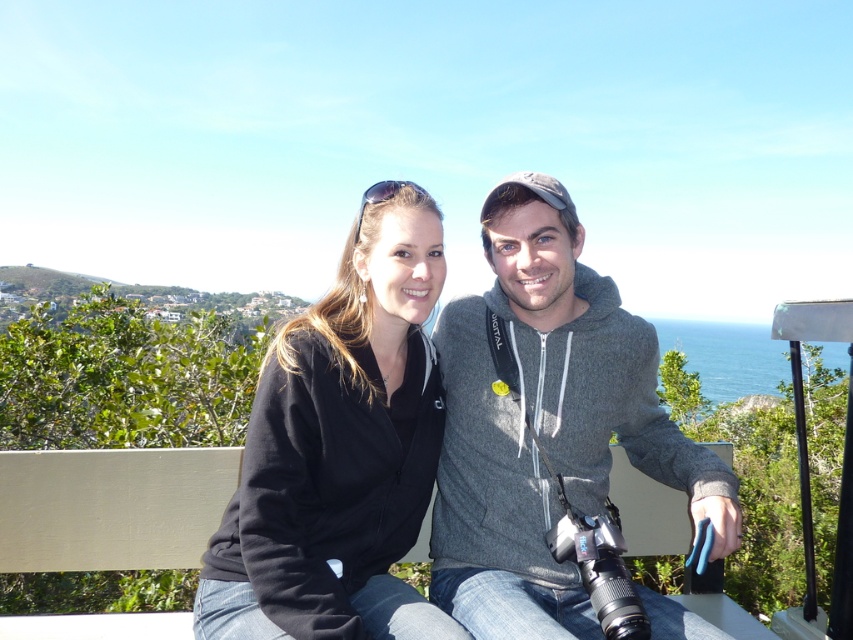
Question: Where is gray fleece hoodie at center located in relation to black fleece jacket at center in the image?

Choices:
 (A) left
 (B) right

Answer: (B)

Question: Which object is closer to the camera taking this photo?

Choices:
 (A) black fleece jacket at center
 (B) gray fleece hoodie at center

Answer: (A)

Question: Which point appears farthest from the camera in this image?

Choices:
 (A) (260, 388)
 (B) (573, 596)

Answer: (B)

Question: Is gray fleece hoodie at center closer to camera compared to black fleece jacket at center?

Choices:
 (A) yes
 (B) no

Answer: (B)

Question: Can you confirm if gray fleece hoodie at center is thinner than black fleece jacket at center?

Choices:
 (A) no
 (B) yes

Answer: (A)